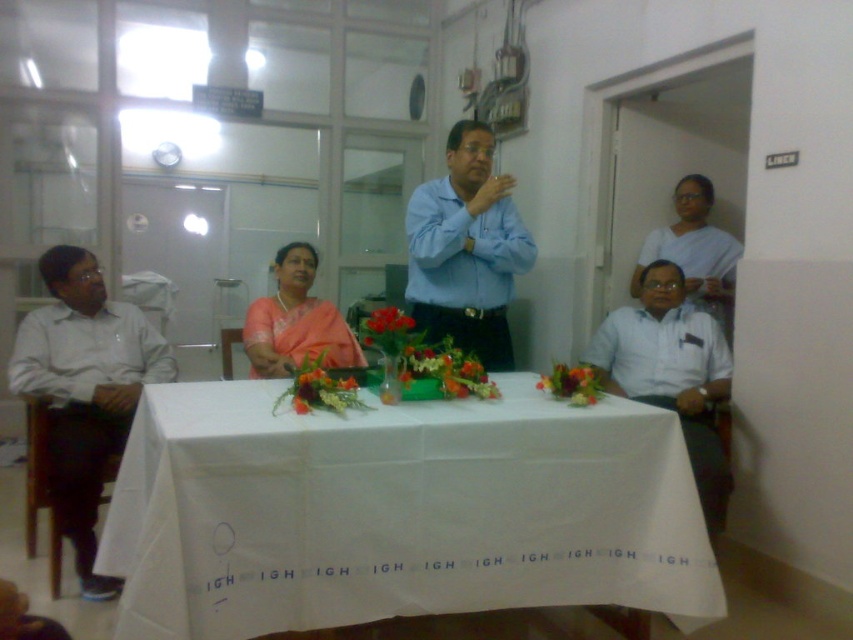
Question: Is white cloth at center positioned in front of floral arrangement at center?

Choices:
 (A) yes
 (B) no

Answer: (A)

Question: Which object appears farthest from the camera in this image?

Choices:
 (A) white shirt at left
 (B) white fabric saree at upper right

Answer: (B)

Question: Is white shirt at right below vivid red petals at center?

Choices:
 (A) yes
 (B) no

Answer: (A)

Question: Which point is farther from the camera taking this photo?

Choices:
 (A) (509, 296)
 (B) (706, 460)
 (C) (318, 307)
 (D) (94, 353)

Answer: (C)

Question: Among these points, which one is farthest from the camera?

Choices:
 (A) (558, 390)
 (B) (318, 378)

Answer: (A)

Question: Does white shirt at left appear on the left side of vivid red petals at center?

Choices:
 (A) no
 (B) yes

Answer: (B)